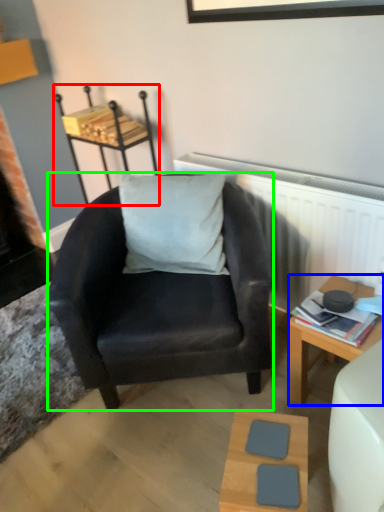
Question: Which is farther away from stool (highlighted by a red box)? desk (highlighted by a blue box) or chair (highlighted by a green box)?

Choices:
 (A) desk
 (B) chair

Answer: (A)